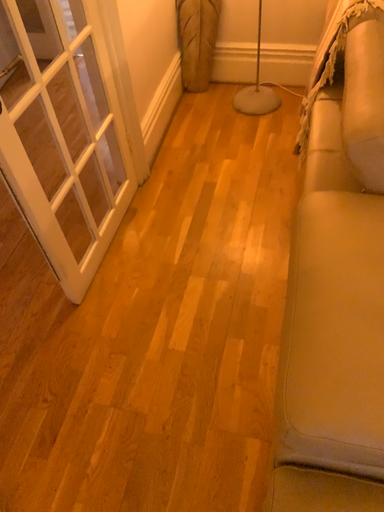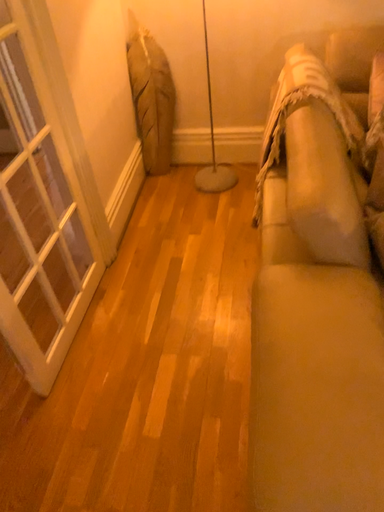
Question: How did the camera likely rotate when shooting the video?

Choices:
 (A) rotated upward
 (B) rotated downward

Answer: (A)